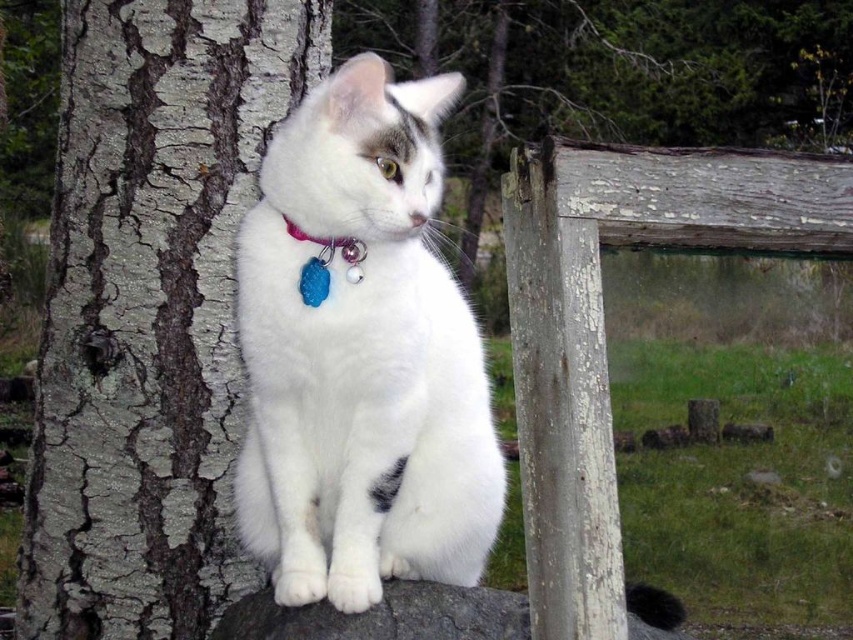
Question: Is gray rough bark tree trunk at left positioned before weathered wood fence at right?

Choices:
 (A) no
 (B) yes

Answer: (A)

Question: Estimate the real-world distances between objects in this image. Which object is closer to the white fluffy cat at center?

Choices:
 (A) gray rough bark tree trunk at left
 (B) weathered wood fence at right
 (C) purple fabric collar at center

Answer: (C)

Question: Can you confirm if white fluffy cat at center is positioned to the left of weathered wood fence at right?

Choices:
 (A) yes
 (B) no

Answer: (A)

Question: Does gray rough bark tree trunk at left appear over weathered wood fence at right?

Choices:
 (A) no
 (B) yes

Answer: (B)

Question: Which point is closer to the camera?

Choices:
 (A) gray rough bark tree trunk at left
 (B) purple fabric collar at center

Answer: (B)

Question: Which point is farther to the camera?

Choices:
 (A) (656, 148)
 (B) (350, 248)

Answer: (B)